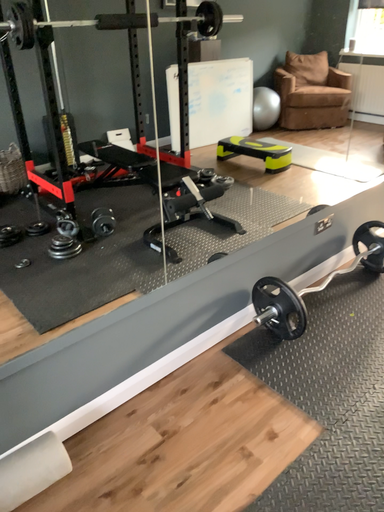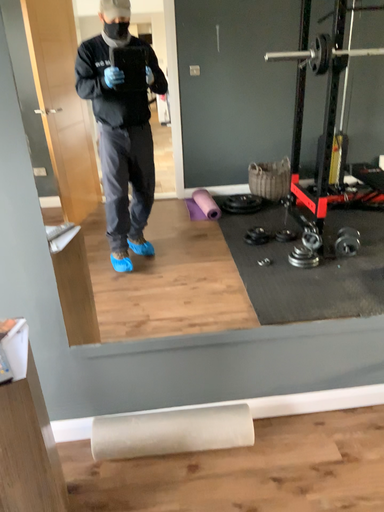
Question: How did the camera likely rotate when shooting the video?

Choices:
 (A) rotated left
 (B) rotated right

Answer: (A)